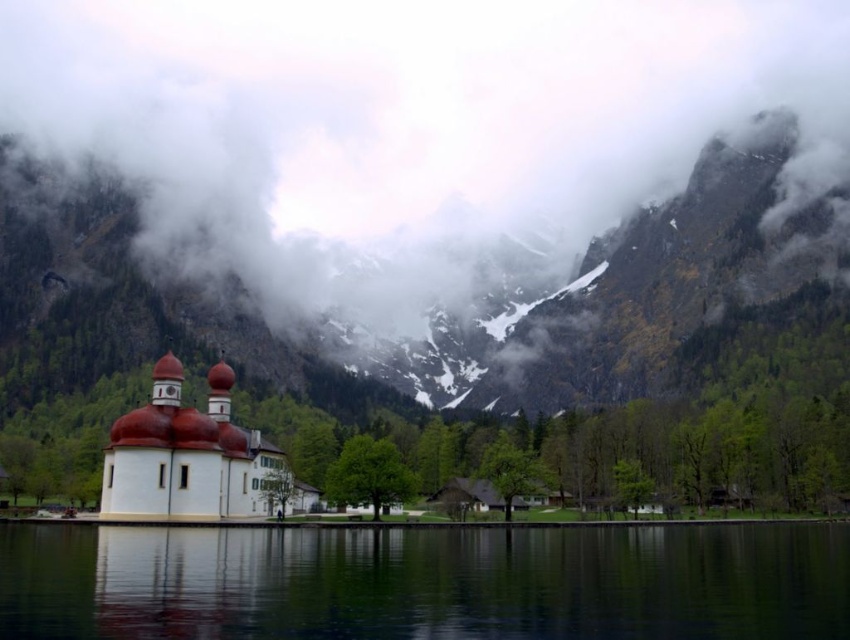
You are an artist trying to paint the scene. You need to place the cloudy fog at upper center in your painting. What coordinates should you use for its position?

The cloudy fog at upper center should be placed at coordinates (414, 122).

You are standing on the dock near the lake and looking at the cloudy fog at upper center and the transparent glass water at center. Which object is closer to you?

The cloudy fog at upper center is closer to you because it is further to the viewer than the transparent glass water at center.